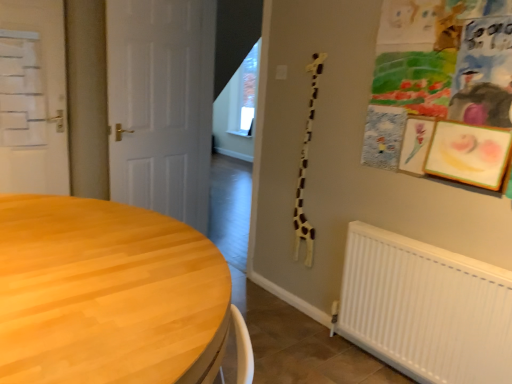
This screenshot has width=512, height=384. Describe the element at coordinates (104, 292) in the screenshot. I see `wooden table at lower left` at that location.

Identify the location of white matte door at left, which ranks as the first door in left-to-right order. The height and width of the screenshot is (384, 512). (33, 98).

Does point (135, 288) come in front of point (161, 38)?

Yes, point (135, 288) is closer to viewer.

Looking at this image, is wooden table at lower left positioned with its back to white matte door at center, marked as the 1th door in a right-to-left arrangement?

No, wooden table at lower left's orientation is not away from white matte door at center, marked as the 1th door in a right-to-left arrangement.

From a real-world perspective, is wooden table at lower left under white matte door at center, marked as the 1th door in a right-to-left arrangement?

Yes.

Is wooden table at lower left in front of white matte door at center, marked as the 1th door in a right-to-left arrangement?

That is True.

Is white matte door at left, which ranks as the first door in left-to-right order, facing towards white matte door at center, marked as the 1th door in a right-to-left arrangement?

No, white matte door at left, which ranks as the first door in left-to-right order, is not oriented towards white matte door at center, marked as the 1th door in a right-to-left arrangement.

From a real-world perspective, is white matte door at left, which ranks as the 2th door in right-to-left order, under white matte door at center, the 2th door viewed from the left?

No.

Is white matte door at left, which ranks as the first door in left-to-right order, to the left of white matte door at center, the 2th door viewed from the left, from the viewer's perspective?

Yes, white matte door at left, which ranks as the first door in left-to-right order, is to the left of white matte door at center, the 2th door viewed from the left.

Does white matte door at left, which ranks as the first door in left-to-right order, lie behind white matte door at center, the 2th door viewed from the left?

No, white matte door at left, which ranks as the first door in left-to-right order, is closer to the camera.

Considering the sizes of objects white matte door at center, marked as the 1th door in a right-to-left arrangement, and white matte door at left, which ranks as the first door in left-to-right order, in the image provided, who is bigger, white matte door at center, marked as the 1th door in a right-to-left arrangement, or white matte door at left, which ranks as the first door in left-to-right order,?

white matte door at center, marked as the 1th door in a right-to-left arrangement.

Consider the image. From the image's perspective, relative to white matte door at left, which ranks as the first door in left-to-right order, is white matte door at center, the 2th door viewed from the left, above or below?

Clearly, from the image's perspective, white matte door at center, the 2th door viewed from the left, is below white matte door at left, which ranks as the first door in left-to-right order.

Is there a large distance between white matte door at center, the 2th door viewed from the left, and white matte door at left, which ranks as the 2th door in right-to-left order?

No, white matte door at center, the 2th door viewed from the left, is not far away from white matte door at left, which ranks as the 2th door in right-to-left order.

Is wooden table at lower left surrounding white matte door at left, which ranks as the first door in left-to-right order?

No, white matte door at left, which ranks as the first door in left-to-right order, is not inside wooden table at lower left.

From a real-world perspective, is wooden table at lower left under white matte door at left, which ranks as the first door in left-to-right order?

Yes, from a real-world perspective, wooden table at lower left is beneath white matte door at left, which ranks as the first door in left-to-right order.

In the scene shown: Can you tell me how much wooden table at lower left and white matte door at left, which ranks as the 2th door in right-to-left order, differ in facing direction?

There is a 95.7-degree angle between the facing directions of wooden table at lower left and white matte door at left, which ranks as the 2th door in right-to-left order.

Is wooden table at lower left to the left of white matte door at left, which ranks as the 2th door in right-to-left order, from the viewer's perspective?

No, wooden table at lower left is not to the left of white matte door at left, which ranks as the 2th door in right-to-left order.

Between white matte door at center, the 2th door viewed from the left, and wooden table at lower left, which one is positioned in front?

wooden table at lower left.

From a real-world perspective, does white matte door at center, marked as the 1th door in a right-to-left arrangement, sit lower than wooden table at lower left?

Actually, white matte door at center, marked as the 1th door in a right-to-left arrangement, is physically above wooden table at lower left in the real world.

Does point (172, 16) appear closer or farther from the camera than point (219, 261)?

Point (172, 16).

Is white matte door at center, marked as the 1th door in a right-to-left arrangement, thinner than wooden table at lower left?

Indeed, white matte door at center, marked as the 1th door in a right-to-left arrangement, has a lesser width compared to wooden table at lower left.

Is white matte door at left, which ranks as the 2th door in right-to-left order, oriented towards wooden table at lower left?

Yes.

Is point (10, 33) closer to viewer compared to point (157, 329)?

No, it is not.

Looking at the image, does white matte door at left, which ranks as the 2th door in right-to-left order, seem bigger or smaller compared to wooden table at lower left?

Considering their sizes, white matte door at left, which ranks as the 2th door in right-to-left order, takes up less space than wooden table at lower left.

Consider the image. Is white matte door at left, which ranks as the 2th door in right-to-left order, completely or partially outside of wooden table at lower left?

Yes.

Locate an element on the screen. table on the right of white matte door at center, the 2th door viewed from the left is located at coordinates (104, 292).

Image resolution: width=512 pixels, height=384 pixels. I want to click on door behind the white matte door at left, which ranks as the 2th door in right-to-left order, so click(161, 105).

From the image, which object appears to be farther from white matte door at center, the 2th door viewed from the left, white matte door at left, which ranks as the first door in left-to-right order, or wooden table at lower left?

wooden table at lower left.

Which object lies nearer to the anchor point wooden table at lower left, white matte door at left, which ranks as the 2th door in right-to-left order, or white matte door at center, marked as the 1th door in a right-to-left arrangement?

The object closer to wooden table at lower left is white matte door at center, marked as the 1th door in a right-to-left arrangement.

From the picture: From the image, which object appears to be nearer to white matte door at left, which ranks as the first door in left-to-right order, wooden table at lower left or white matte door at center, marked as the 1th door in a right-to-left arrangement?

white matte door at center, marked as the 1th door in a right-to-left arrangement, is positioned closer to the anchor white matte door at left, which ranks as the first door in left-to-right order.

Based on their spatial positions, is white matte door at center, marked as the 1th door in a right-to-left arrangement, or wooden table at lower left further from white matte door at left, which ranks as the first door in left-to-right order?

wooden table at lower left.

Looking at the image, which one is located closer to wooden table at lower left, white matte door at center, marked as the 1th door in a right-to-left arrangement, or white matte door at left, which ranks as the first door in left-to-right order?

white matte door at center, marked as the 1th door in a right-to-left arrangement, is positioned closer to the anchor wooden table at lower left.

When comparing their distances from white matte door at center, marked as the 1th door in a right-to-left arrangement, does wooden table at lower left or white matte door at left, which ranks as the first door in left-to-right order, seem further?

The object further to white matte door at center, marked as the 1th door in a right-to-left arrangement, is wooden table at lower left.

Find the location of a particular element. The width and height of the screenshot is (512, 384). door between wooden table at lower left and white matte door at center, marked as the 1th door in a right-to-left arrangement, in the front-back direction is located at coordinates (33, 98).